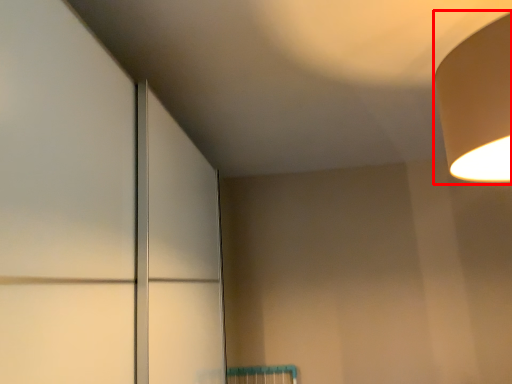
Question: From the image, what is the correct spatial relationship of lamp (annotated by the red box) in relation to door?

Choices:
 (A) left
 (B) right

Answer: (B)